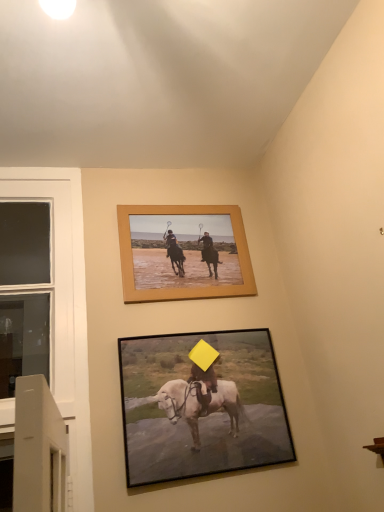
Question: Is white glass window at left shorter than black matte picture frame at lower center, the second picture frame positioned from the top?

Choices:
 (A) no
 (B) yes

Answer: (A)

Question: Is white glass window at left not close to black matte picture frame at lower center, which is the first picture frame in bottom-to-top order?

Choices:
 (A) yes
 (B) no

Answer: (B)

Question: Is black matte picture frame at lower center, the second picture frame positioned from the top, at the back of white glass window at left?

Choices:
 (A) yes
 (B) no

Answer: (B)

Question: Is white glass window at left to the right of black matte picture frame at lower center, which is the first picture frame in bottom-to-top order, from the viewer's perspective?

Choices:
 (A) no
 (B) yes

Answer: (A)

Question: Considering the relative positions of white glass window at left and black matte picture frame at lower center, which is the first picture frame in bottom-to-top order, in the image provided, is white glass window at left behind black matte picture frame at lower center, which is the first picture frame in bottom-to-top order,?

Choices:
 (A) yes
 (B) no

Answer: (A)

Question: Considering their positions, is white glass window at left located in front of or behind wooden frame at upper center, the first picture frame positioned from the top?

Choices:
 (A) behind
 (B) front

Answer: (B)

Question: Considering the relative positions of white glass window at left and wooden frame at upper center, the first picture frame positioned from the top, in the image provided, is white glass window at left to the left or to the right of wooden frame at upper center, the first picture frame positioned from the top,?

Choices:
 (A) right
 (B) left

Answer: (B)

Question: From a real-world perspective, is white glass window at left above or below wooden frame at upper center, the first picture frame positioned from the top?

Choices:
 (A) above
 (B) below

Answer: (B)

Question: Considering the positions of white glass window at left and wooden frame at upper center, the first picture frame positioned from the top, in the image, is white glass window at left bigger or smaller than wooden frame at upper center, the first picture frame positioned from the top,?

Choices:
 (A) big
 (B) small

Answer: (A)

Question: Is point (8, 222) positioned closer to the camera than point (168, 402)?

Choices:
 (A) closer
 (B) farther

Answer: (B)

Question: Is white glass window at left taller or shorter than black matte picture frame at lower center, which is the first picture frame in bottom-to-top order?

Choices:
 (A) tall
 (B) short

Answer: (A)

Question: Is white glass window at left in front of or behind black matte picture frame at lower center, which is the first picture frame in bottom-to-top order, in the image?

Choices:
 (A) behind
 (B) front

Answer: (A)

Question: From the image's perspective, relative to black matte picture frame at lower center, which is the first picture frame in bottom-to-top order, is white glass window at left above or below?

Choices:
 (A) below
 (B) above

Answer: (B)

Question: Based on their sizes in the image, would you say black matte picture frame at lower center, which is the first picture frame in bottom-to-top order, is bigger or smaller than white glass window at left?

Choices:
 (A) big
 (B) small

Answer: (B)

Question: Do you think black matte picture frame at lower center, which is the first picture frame in bottom-to-top order, is within white glass window at left, or outside of it?

Choices:
 (A) inside
 (B) outside

Answer: (B)